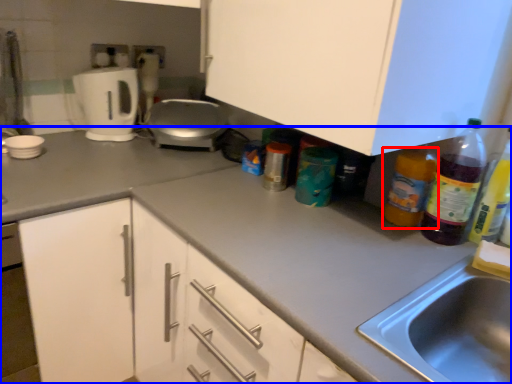
Question: Among these objects, which one is farthest to the camera, bottle (highlighted by a red box) or countertop (highlighted by a blue box)?

Choices:
 (A) bottle
 (B) countertop

Answer: (A)